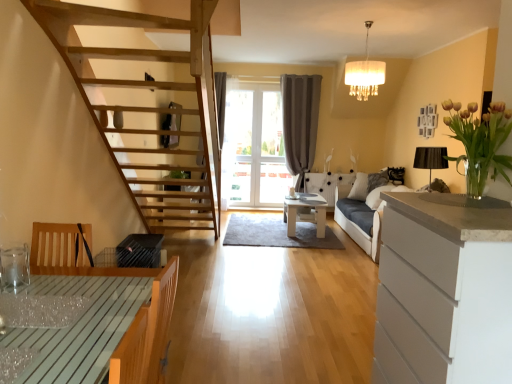
Identify the location of free space above transparent glass table at lower left (from a real-world perspective). The height and width of the screenshot is (384, 512). (31, 302).